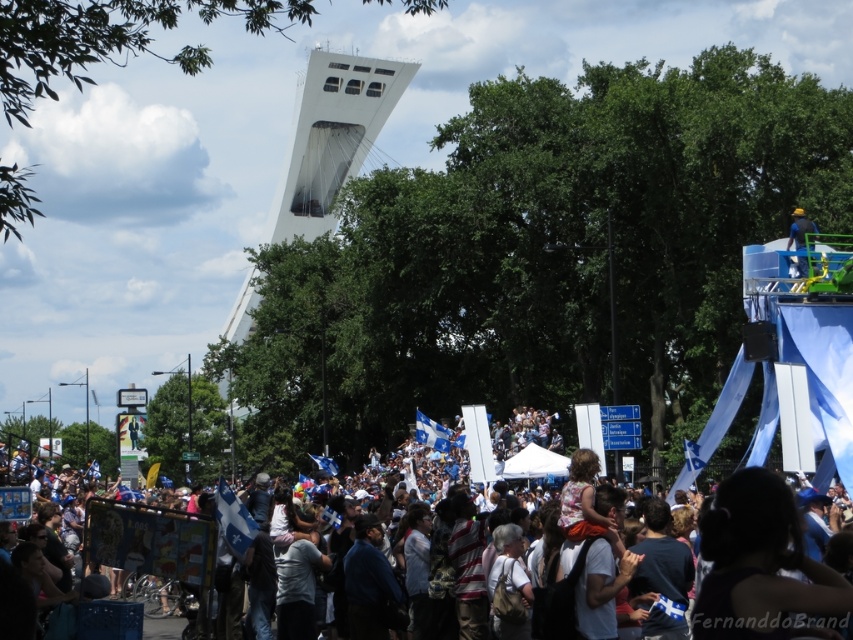
How distant is white smooth tower at center from white cotton crowd at lower center?

The distance of white smooth tower at center from white cotton crowd at lower center is 52.95 meters.

Is white smooth tower at center above white cotton crowd at lower center?

Yes, white smooth tower at center is above white cotton crowd at lower center.

Describe the element at coordinates (331, 136) in the screenshot. I see `white smooth tower at center` at that location.

You are a GUI agent. You are given a task and a screenshot of the screen. Output one action in this format:
    pyautogui.click(x=<x>, y=<y>)
    Task: Click on the white smooth tower at center
    The image size is (853, 640).
    Given the screenshot: What is the action you would take?
    pyautogui.click(x=331, y=136)

Between white cotton crowd at lower center and yellow matte helmet at upper right, which one is positioned higher?

yellow matte helmet at upper right

The width and height of the screenshot is (853, 640). Describe the element at coordinates (523, 420) in the screenshot. I see `white cotton crowd at lower center` at that location.

In order to click on white cotton crowd at lower center in this screenshot , I will do `click(523, 420)`.

Which is above, white smooth tower at center or yellow matte helmet at upper right?

Positioned higher is white smooth tower at center.

Does white smooth tower at center lie in front of yellow matte helmet at upper right?

That is False.

The image size is (853, 640). In order to click on white smooth tower at center in this screenshot , I will do `click(331, 136)`.